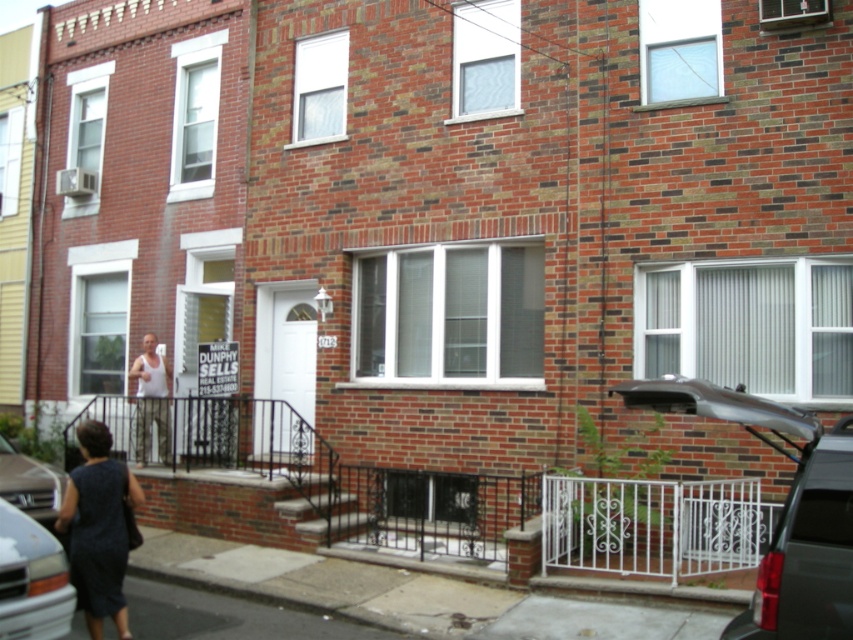
Question: Is dark gray dress at lower left further to camera compared to white tank top at center?

Choices:
 (A) yes
 (B) no

Answer: (B)

Question: Estimate the real-world distances between objects in this image. Which object is farther from the silver metallic van at lower left?

Choices:
 (A) white tank top at center
 (B) matte black car at right

Answer: (A)

Question: Can you confirm if matte black car at right is wider than silver metallic sedan at lower left?

Choices:
 (A) no
 (B) yes

Answer: (B)

Question: Can you confirm if matte black car at right is wider than silver metallic sedan at lower left?

Choices:
 (A) yes
 (B) no

Answer: (A)

Question: Based on their relative distances, which object is nearer to the dark gray dress at lower left?

Choices:
 (A) silver metallic sedan at lower left
 (B) white tank top at center

Answer: (A)

Question: Which object appears closest to the camera in this image?

Choices:
 (A) white tank top at center
 (B) matte black car at right
 (C) silver metallic van at lower left
 (D) dark gray dress at lower left

Answer: (C)